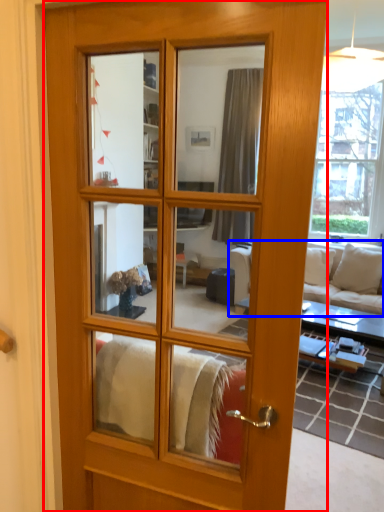
Question: Which point is closer to the camera, door (highlighted by a red box) or studio couch (highlighted by a blue box)?

Choices:
 (A) door
 (B) studio couch

Answer: (A)